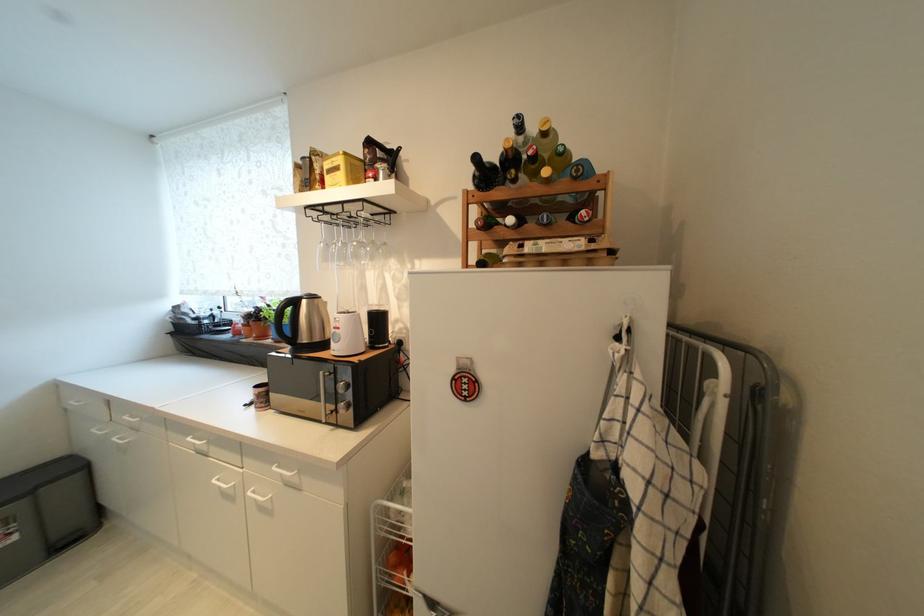
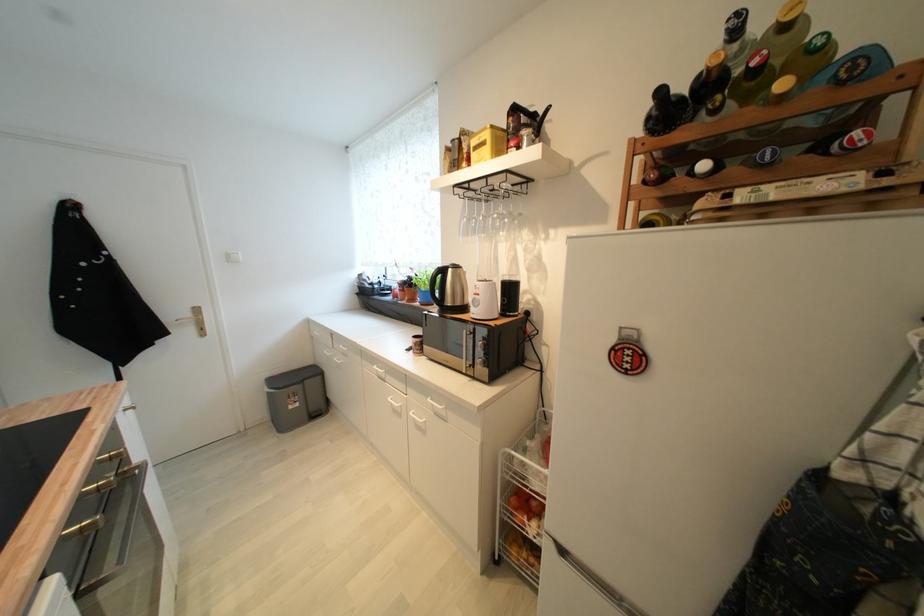
Locate, in the second image, the point that corresponds to point (344, 330) in the first image.

(483, 296)